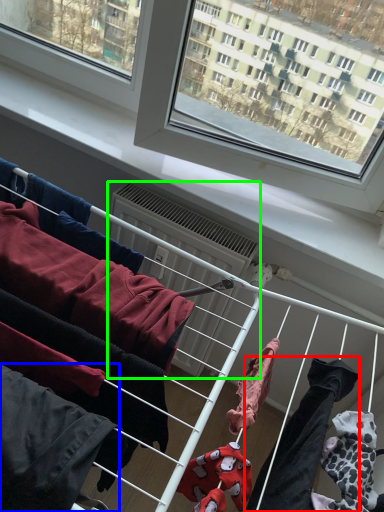
Question: Based on their relative distances, which object is farther from clothing (highlighted by a red box)? Choose from clothing (highlighted by a blue box) and air conditioner (highlighted by a green box).

Choices:
 (A) clothing
 (B) air conditioner

Answer: (B)